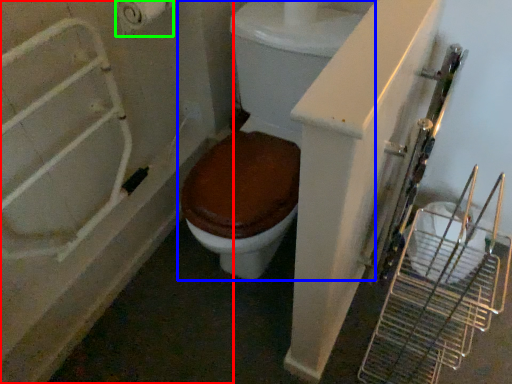
Question: Which is nearer to the bath (highlighted by a red box)? toilet (highlighted by a blue box) or toilet paper (highlighted by a green box).

Choices:
 (A) toilet
 (B) toilet paper

Answer: (A)